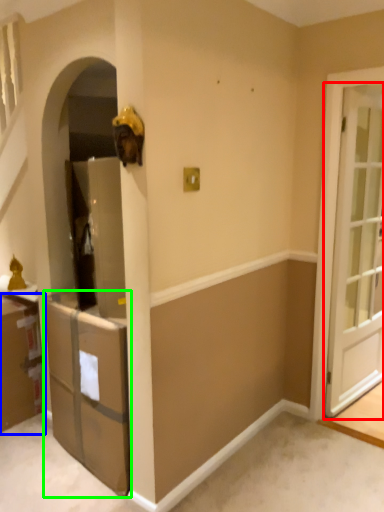
Question: Considering the real-world distances, which object is closest to door (highlighted by a red box)? cabinetry (highlighted by a blue box) or cabinetry (highlighted by a green box).

Choices:
 (A) cabinetry
 (B) cabinetry

Answer: (B)